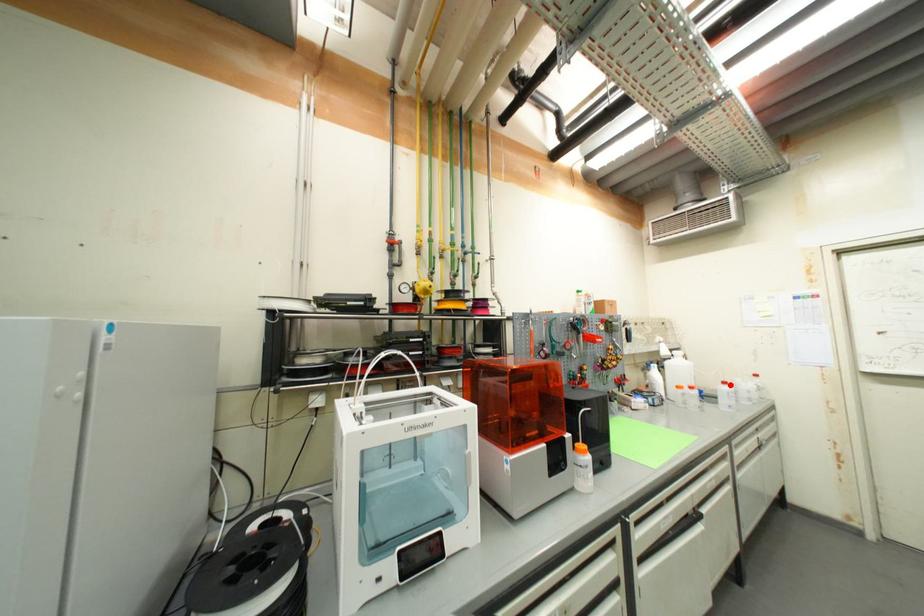
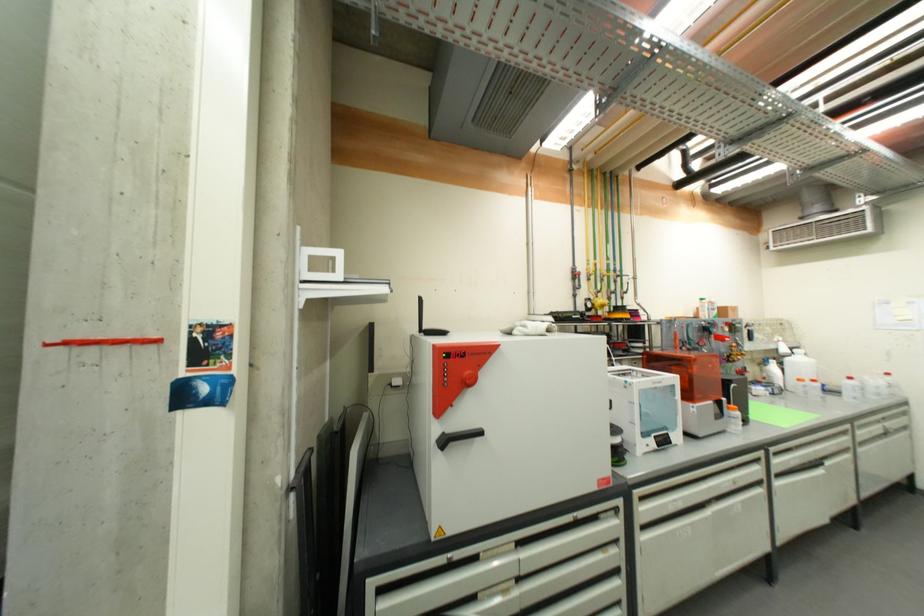
Question: I am providing you with two images of the same scene from different viewpoints. Given a red point in image1, look at the same physical point in image2. Is it:

Choices:
 (A) Closer to the viewpoint
 (B) Farther from the viewpoint

Answer: (A)